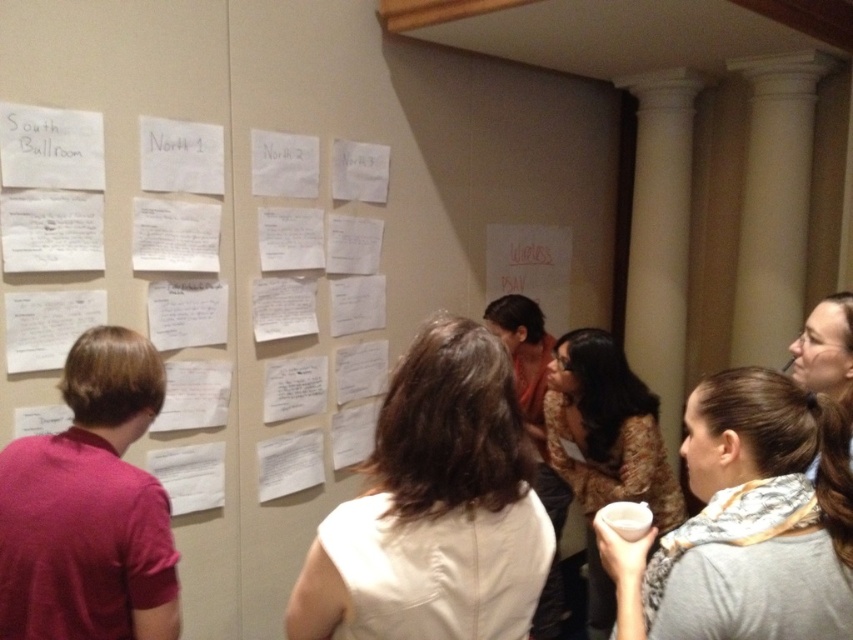
Question: Is white fabric shirt at center to the right of floral-patterned dress at center from the viewer's perspective?

Choices:
 (A) yes
 (B) no

Answer: (B)

Question: In this image, where is white fabric shirt at center located relative to matte red shirt at left?

Choices:
 (A) right
 (B) left

Answer: (A)

Question: Which of the following is the farthest from the observer?

Choices:
 (A) floral-patterned dress at center
 (B) matte red shirt at left
 (C) gray fabric scarf at lower right

Answer: (A)

Question: Considering the real-world distances, which object is closest to the gray fabric scarf at lower right?

Choices:
 (A) white fabric shirt at center
 (B) smooth brown hair at upper right
 (C) matte red shirt at left
 (D) floral-patterned dress at center

Answer: (B)

Question: Estimate the real-world distances between objects in this image. Which object is farther from the matte red shirt at left?

Choices:
 (A) gray fabric scarf at lower right
 (B) floral-patterned dress at center
 (C) smooth brown hair at upper right

Answer: (B)

Question: Is matte red shirt at left further to the viewer compared to floral-patterned dress at center?

Choices:
 (A) no
 (B) yes

Answer: (A)